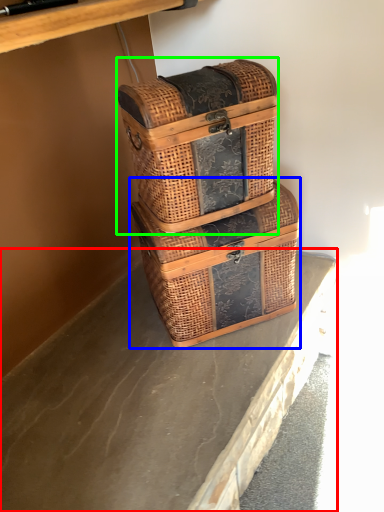
Question: Considering the real-world distances, which object is closest to concrete (highlighted by a red box)? picnic basket (highlighted by a blue box) or picnic basket (highlighted by a green box).

Choices:
 (A) picnic basket
 (B) picnic basket

Answer: (A)